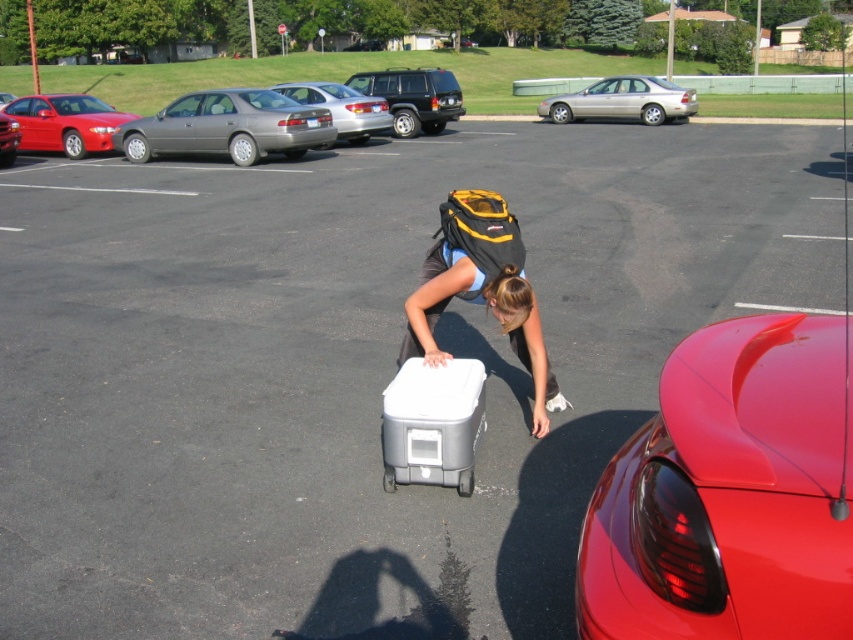
Does satin silver sedan at upper left have a larger size compared to silver metallic sedan at center?

Actually, satin silver sedan at upper left might be smaller than silver metallic sedan at center.

Who is positioned more to the left, satin silver sedan at upper left or silver metallic sedan at center?

Positioned to the left is satin silver sedan at upper left.

What do you see at coordinates (227, 125) in the screenshot? I see `satin silver sedan at upper left` at bounding box center [227, 125].

Identify the location of satin silver sedan at upper left. tap(227, 125).

Does matte black backpack at center have a greater height compared to silver metallic suv at center?

In fact, matte black backpack at center may be shorter than silver metallic suv at center.

Which is more to the left, matte black backpack at center or silver metallic suv at center?

silver metallic suv at center

Image resolution: width=853 pixels, height=640 pixels. What are the coordinates of `matte black backpack at center` in the screenshot? It's located at (482, 289).

At what (x,y) coordinates should I click in order to perform the action: click on matte black backpack at center. Please return your answer as a coordinate pair (x, y). The image size is (853, 640). Looking at the image, I should click on [482, 289].

Who is more forward, (x=61, y=131) or (x=648, y=116)?

Positioned in front is point (x=61, y=131).

Is point (84, 116) less distant than point (538, 106)?

Yes, point (84, 116) is in front of point (538, 106).

Who is more distant from viewer, (103, 122) or (618, 92)?

Point (618, 92)

In order to click on shiny metallic sedan at left in this screenshot , I will do `click(65, 124)`.